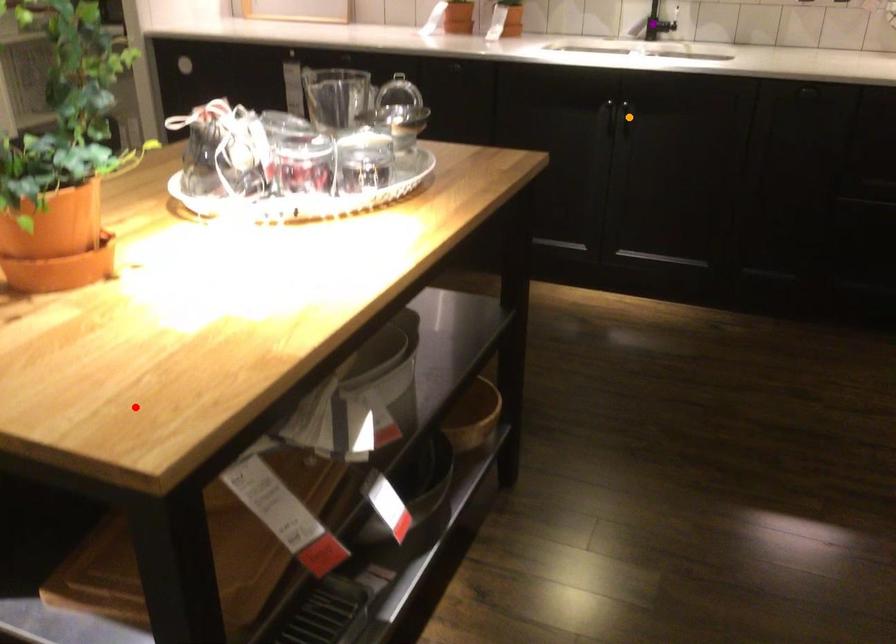
Order these from nearest to farthest:
A) red point
B) purple point
C) orange point

purple point < orange point < red point